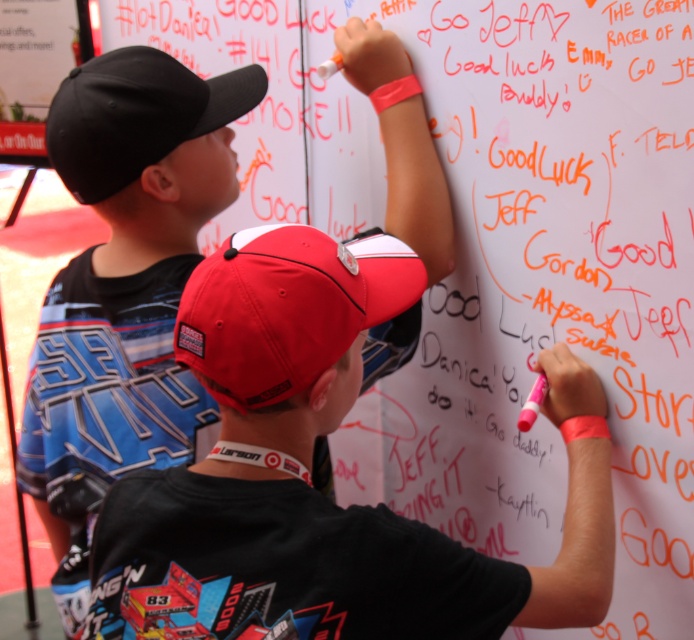
Question: Which point is closer to the camera?

Choices:
 (A) (287, 224)
 (B) (133, 216)
 (C) (130, 140)

Answer: (C)

Question: Can you confirm if black matte cap at upper left is positioned above shiny red baseball cap at center?

Choices:
 (A) no
 (B) yes

Answer: (A)

Question: Can you confirm if black matte cap at upper left is positioned below shiny red baseball cap at center?

Choices:
 (A) no
 (B) yes

Answer: (B)

Question: Considering the real-world distances, which object is farthest from the shiny red baseball cap at center?

Choices:
 (A) black matte cap at upper left
 (B) black fabric baseball cap at upper left

Answer: (B)

Question: Can you confirm if black matte cap at upper left is bigger than black fabric baseball cap at upper left?

Choices:
 (A) yes
 (B) no

Answer: (A)

Question: Estimate the real-world distances between objects in this image. Which object is farther from the black matte cap at upper left?

Choices:
 (A) shiny red baseball cap at center
 (B) black fabric baseball cap at upper left

Answer: (A)